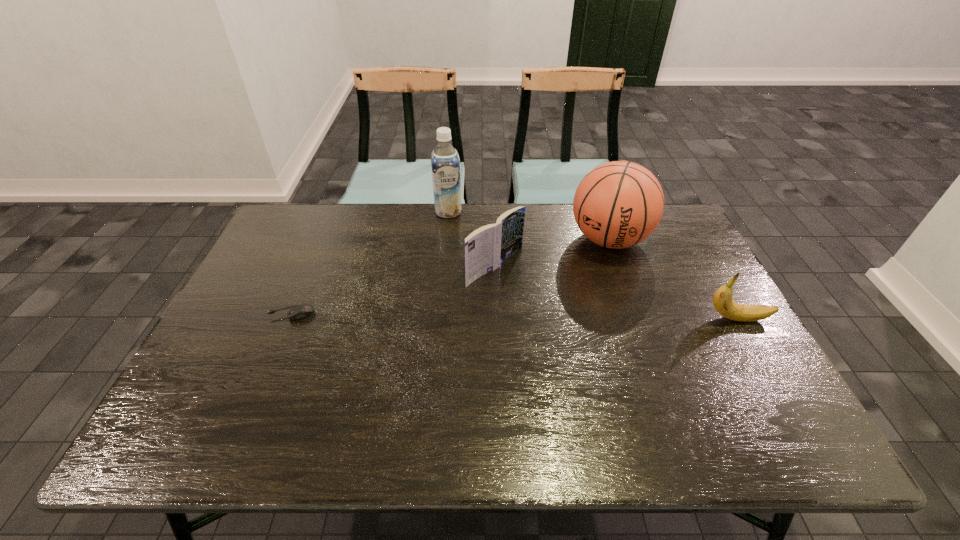
You are a GUI agent. You are given a task and a screenshot of the screen. Output one action in this format:
    pyautogui.click(x=<x>, y=<y>)
    Task: Click on the basketball that is positioned at the right edge
    
    Given the screenshot: What is the action you would take?
    pyautogui.click(x=619, y=204)

Where is `object located at the far right corner`? The image size is (960, 540). object located at the far right corner is located at coordinates (619, 204).

Where is `free space at the far edge of the desktop`? The height and width of the screenshot is (540, 960). free space at the far edge of the desktop is located at coordinates (434, 224).

Where is `free space at the near edge`? Image resolution: width=960 pixels, height=540 pixels. free space at the near edge is located at coordinates (464, 390).

The height and width of the screenshot is (540, 960). In order to click on blank area at the left edge in this screenshot , I will do `click(290, 273)`.

Identify the location of vacant area at the right edge. (737, 373).

Where is `free space between the second object from left to right and the basketball`? free space between the second object from left to right and the basketball is located at coordinates (529, 226).

Locate an element on the screen. The height and width of the screenshot is (540, 960). vacant area between the soya milk and the rightmost object is located at coordinates (592, 265).

This screenshot has height=540, width=960. What are the coordinates of `free point between the shortest object and the rightmost object` in the screenshot? It's located at (514, 316).

At what (x,y) coordinates should I click in order to perform the action: click on vacant region between the banana and the second object from left to right. Please return your answer as a coordinate pair (x, y). Looking at the image, I should click on (592, 265).